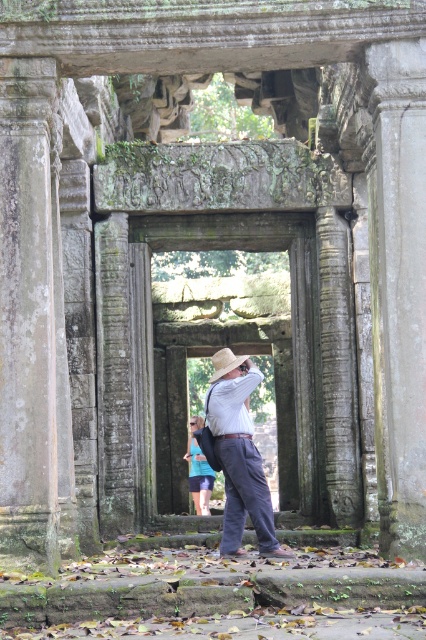
Question: Among these points, which one is farthest from the camera?

Choices:
 (A) (226, 369)
 (B) (232, 506)
 (C) (212, 486)

Answer: (C)

Question: Can you confirm if light brown straw hat at center is positioned to the right of natural straw cowboy hat at center?

Choices:
 (A) yes
 (B) no

Answer: (A)

Question: Which of these objects is positioned closest to the light brown straw hat at center?

Choices:
 (A) blue fabric dress at center
 (B) natural straw cowboy hat at center

Answer: (B)

Question: Which object appears farthest from the camera in this image?

Choices:
 (A) blue fabric dress at center
 (B) natural straw cowboy hat at center
 (C) light brown straw hat at center

Answer: (A)

Question: Can you confirm if blue fabric dress at center is positioned to the right of natural straw cowboy hat at center?

Choices:
 (A) yes
 (B) no

Answer: (B)

Question: Considering the relative positions of blue fabric dress at center and natural straw cowboy hat at center in the image provided, where is blue fabric dress at center located with respect to natural straw cowboy hat at center?

Choices:
 (A) below
 (B) above

Answer: (A)